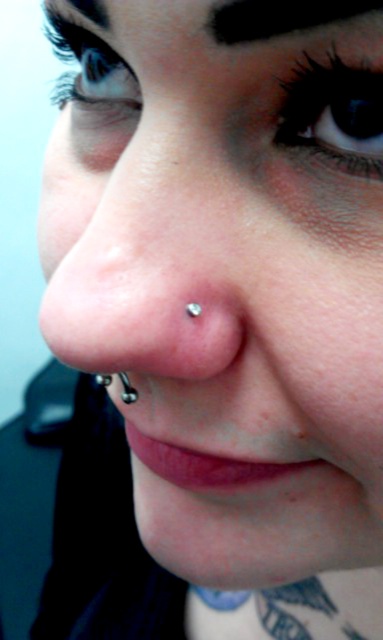
The width and height of the screenshot is (383, 640). What do you see at coordinates (333, 113) in the screenshot?
I see `blue iridescent eye at upper center` at bounding box center [333, 113].

Between blue iridescent eye at upper center and silver metallic stud at nose, which one is positioned lower?

silver metallic stud at nose is below.

The image size is (383, 640). What are the coordinates of `blue iridescent eye at upper center` in the screenshot? It's located at (333, 113).

Does blue iridescent eye at upper center appear over matte pink lipstick at lower center?

Indeed, blue iridescent eye at upper center is positioned over matte pink lipstick at lower center.

Between point (327, 113) and point (196, 484), which one is positioned in front?

Point (327, 113) is more forward.

Identify the location of blue iridescent eye at upper center. (333, 113).

This screenshot has width=383, height=640. I want to click on clear skin nose piercing at center, so click(x=129, y=252).

Which is below, clear skin nose piercing at center or silver metallic stud at nose?

silver metallic stud at nose is below.

Which is in front, point (168, 349) or point (121, 381)?

Point (168, 349) is more forward.

At what (x,y) coordinates should I click in order to perform the action: click on clear skin nose piercing at center. Please return your answer as a coordinate pair (x, y). The width and height of the screenshot is (383, 640). Looking at the image, I should click on click(x=129, y=252).